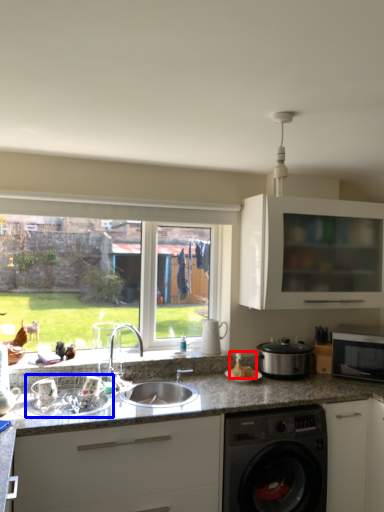
Question: Which of the following is the closest to the observer, food (highlighted by a red box) or appliance (highlighted by a blue box)?

Choices:
 (A) food
 (B) appliance

Answer: (B)